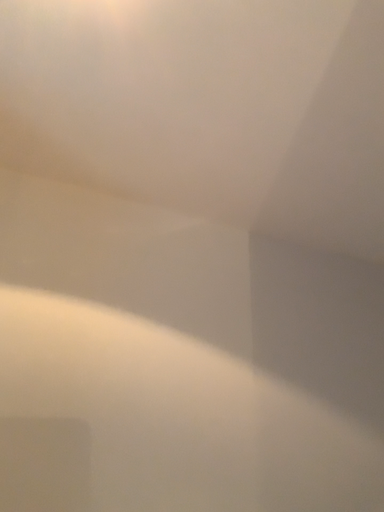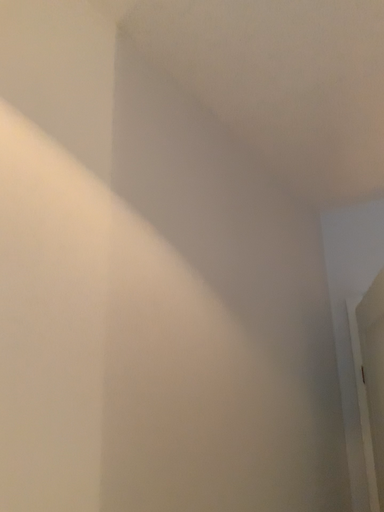
Question: Which way did the camera rotate in the video?

Choices:
 (A) rotated upward
 (B) rotated downward

Answer: (B)